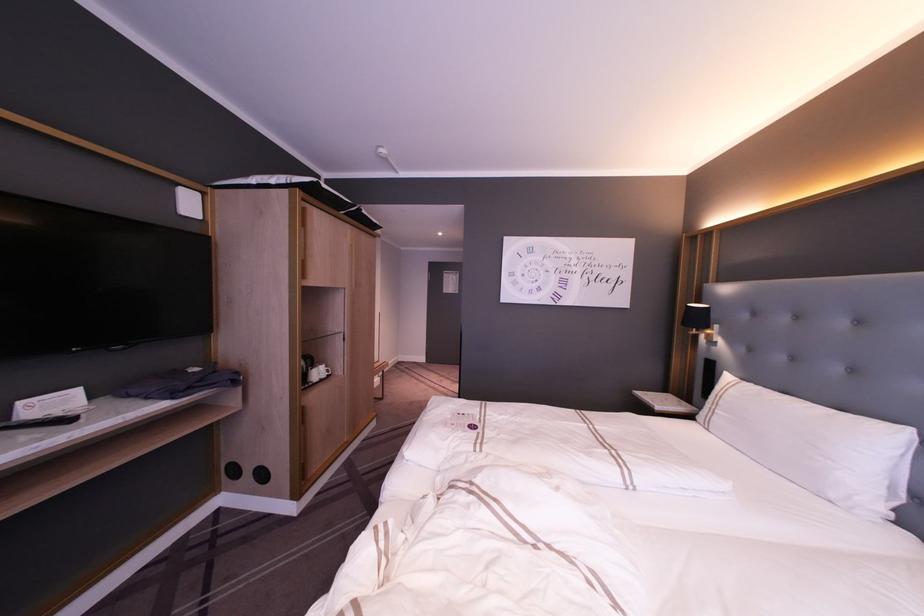
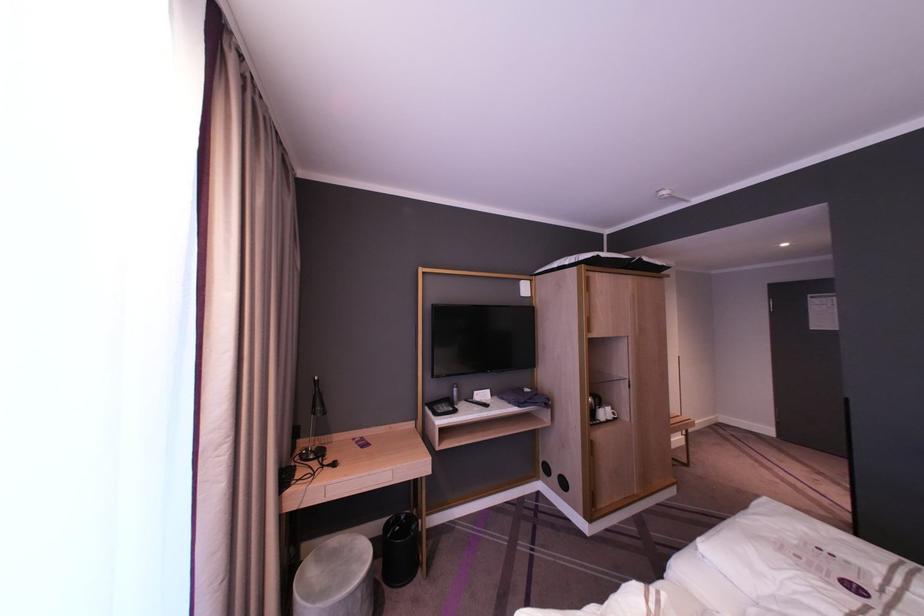
Locate, in the second image, the point that corresponds to (x=310, y=362) in the first image.

(599, 400)